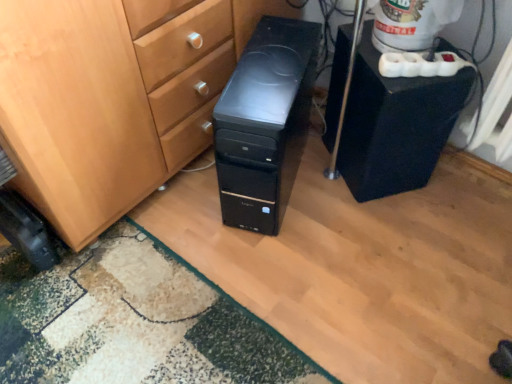
Identify the location of vacant area that is situated to the right of green textured rug at lower left. (359, 269).